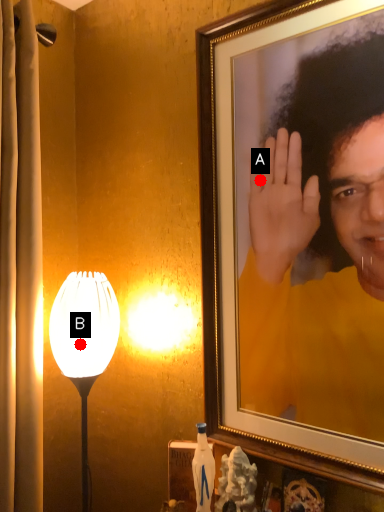
Question: Two points are circled on the image, labeled by A and B beside each circle. Which point is farther from the camera taking this photo?

Choices:
 (A) A is further
 (B) B is further

Answer: (B)